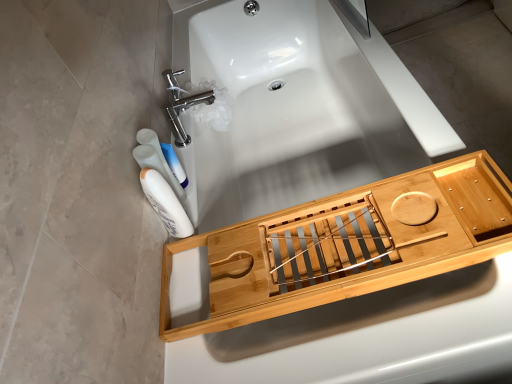
Question: From the image's perspective, does polished chrome faucet at upper left appear lower than white glossy bottle at lower left, which ranks as the second mouthwash in front-to-back order?

Choices:
 (A) yes
 (B) no

Answer: (B)

Question: Is polished chrome faucet at upper left not close to white glossy bottle at lower left, which ranks as the second mouthwash in front-to-back order?

Choices:
 (A) no
 (B) yes

Answer: (A)

Question: Is white glossy bottle at lower left, the 1th mouthwash positioned from the back, located within polished chrome faucet at upper left?

Choices:
 (A) no
 (B) yes

Answer: (A)

Question: Is polished chrome faucet at upper left at the left side of white glossy bottle at lower left, which ranks as the second mouthwash in front-to-back order?

Choices:
 (A) yes
 (B) no

Answer: (B)

Question: Is polished chrome faucet at upper left bigger than white glossy bottle at lower left, which ranks as the second mouthwash in front-to-back order?

Choices:
 (A) yes
 (B) no

Answer: (A)

Question: Is natural wood bath caddy at lower right wider or thinner than natural wood bath tray at center?

Choices:
 (A) thin
 (B) wide

Answer: (A)

Question: From their relative heights in the image, would you say natural wood bath caddy at lower right is taller or shorter than natural wood bath tray at center?

Choices:
 (A) tall
 (B) short

Answer: (B)

Question: Does point (476, 187) appear closer or farther from the camera than point (287, 92)?

Choices:
 (A) farther
 (B) closer

Answer: (B)

Question: From a real-world perspective, is natural wood bath caddy at lower right above or below natural wood bath tray at center?

Choices:
 (A) below
 (B) above

Answer: (B)

Question: Looking at the image, does natural wood bath caddy at lower right seem bigger or smaller compared to white glossy mouthwash at left, which is the 1th mouthwash from front to back?

Choices:
 (A) big
 (B) small

Answer: (A)

Question: Visually, is natural wood bath caddy at lower right positioned to the left or to the right of white glossy mouthwash at left, which is the 1th mouthwash from front to back?

Choices:
 (A) left
 (B) right

Answer: (B)

Question: Is natural wood bath caddy at lower right inside the boundaries of white glossy mouthwash at left, the second mouthwash when ordered from back to front, or outside?

Choices:
 (A) outside
 (B) inside

Answer: (A)

Question: In terms of width, does natural wood bath caddy at lower right look wider or thinner when compared to white glossy mouthwash at left, the second mouthwash when ordered from back to front?

Choices:
 (A) thin
 (B) wide

Answer: (B)

Question: Visually, is natural wood bath caddy at lower right positioned to the left or to the right of white glossy bottle at lower left, the 1th mouthwash positioned from the back?

Choices:
 (A) left
 (B) right

Answer: (B)

Question: From a real-world perspective, is natural wood bath caddy at lower right above or below white glossy bottle at lower left, the 1th mouthwash positioned from the back?

Choices:
 (A) below
 (B) above

Answer: (A)